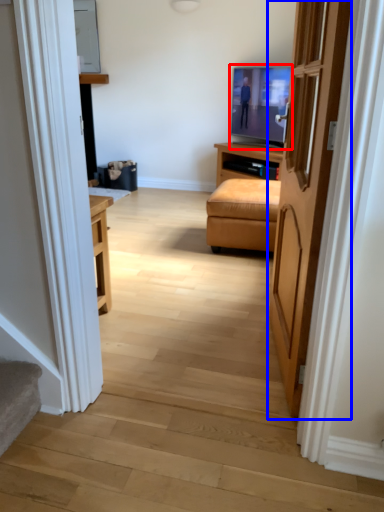
Question: Which object is further to the camera taking this photo, television (highlighted by a red box) or door (highlighted by a blue box)?

Choices:
 (A) television
 (B) door

Answer: (A)